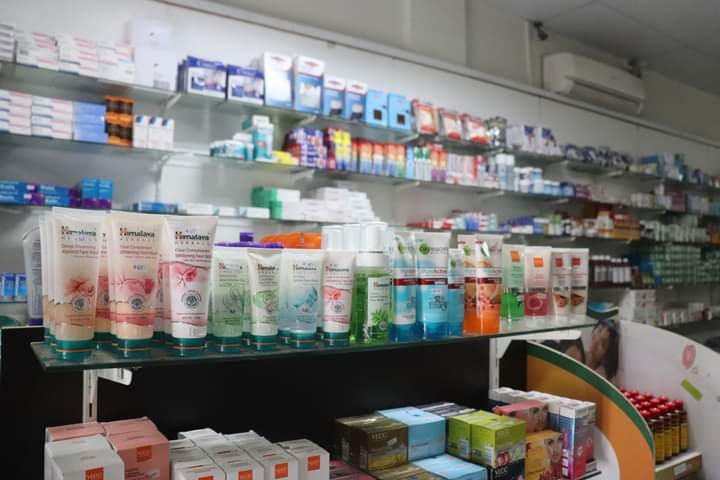
The image size is (720, 480). In order to click on boxes in this screenshot , I will do `click(90, 186)`.